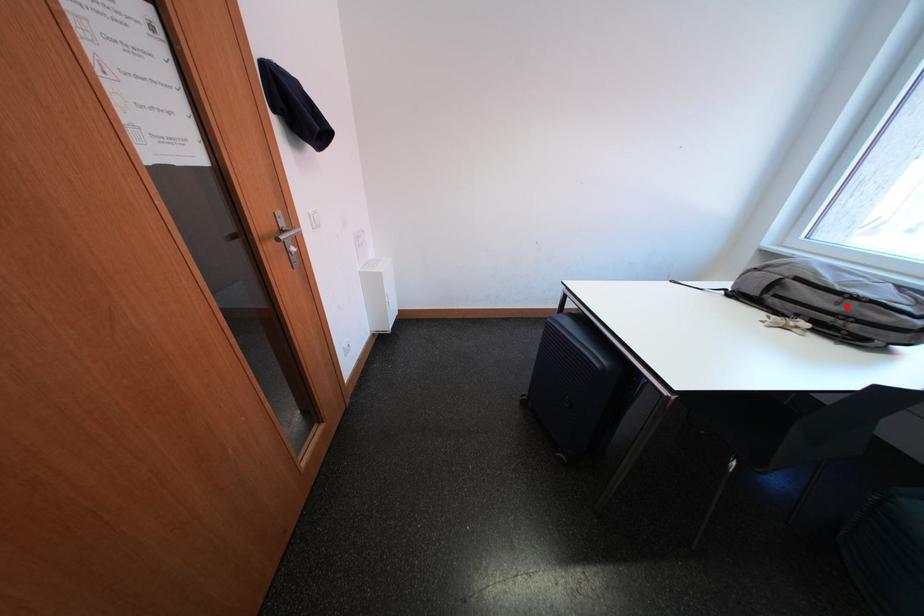
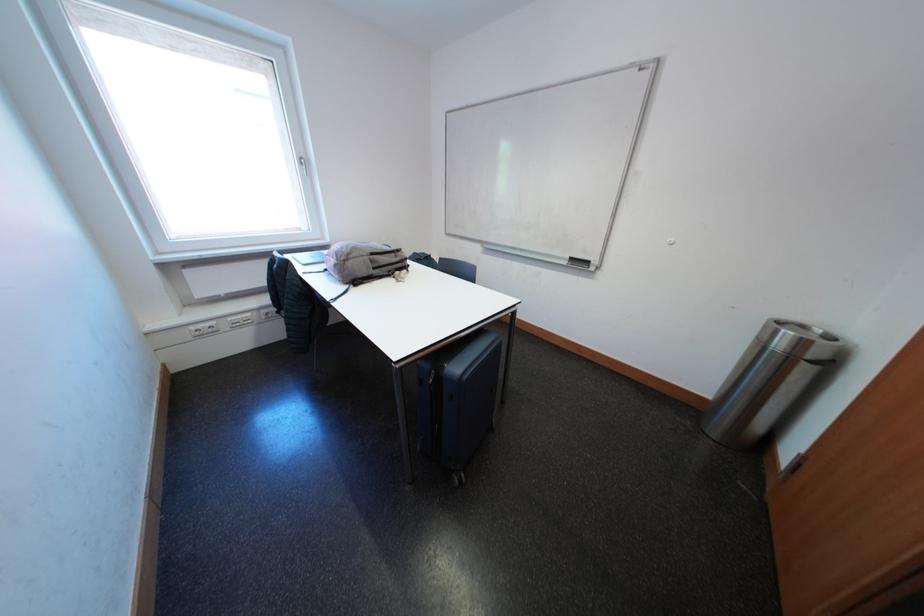
Question: I am providing you with two images of the same scene from different viewpoints. Given a red point in image1, look at the same physical point in image2. Is it:

Choices:
 (A) Closer to the viewpoint
 (B) Farther from the viewpoint

Answer: (A)